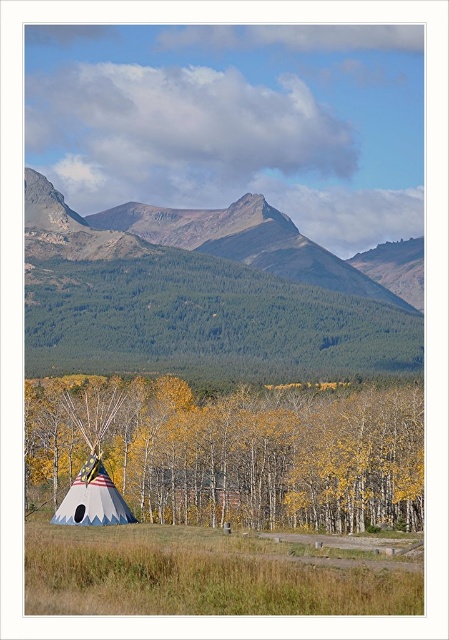
Question: Does green forested mountain at upper center come behind american flag fabric teepee at lower left?

Choices:
 (A) yes
 (B) no

Answer: (A)

Question: Which is nearer to the american flag fabric teepee at lower left?

Choices:
 (A) green forested mountain at upper center
 (B) white fabric teepee at lower left

Answer: (B)

Question: Considering the real-world distances, which object is closest to the white fabric teepee at lower left?

Choices:
 (A) american flag fabric teepee at lower left
 (B) green forested mountain at upper center

Answer: (A)

Question: From the image, what is the correct spatial relationship of white fabric teepee at lower left in relation to american flag fabric teepee at lower left?

Choices:
 (A) left
 (B) right

Answer: (B)

Question: Which point is closer to the camera?

Choices:
 (A) (285, 307)
 (B) (170, 417)

Answer: (B)

Question: Is green forested mountain at upper center to the right of american flag fabric teepee at lower left from the viewer's perspective?

Choices:
 (A) no
 (B) yes

Answer: (B)